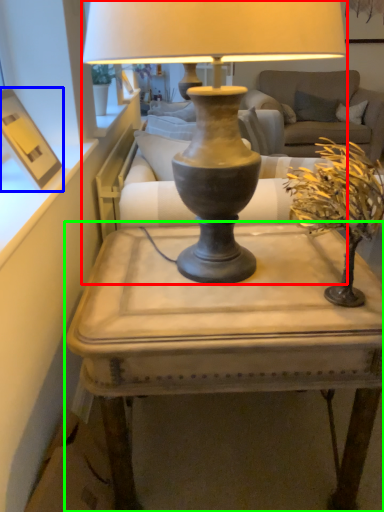
Question: Which object is the closest to the lamp (highlighted by a red box)? Choose among these: picture frame (highlighted by a blue box) or table (highlighted by a green box).

Choices:
 (A) picture frame
 (B) table

Answer: (B)